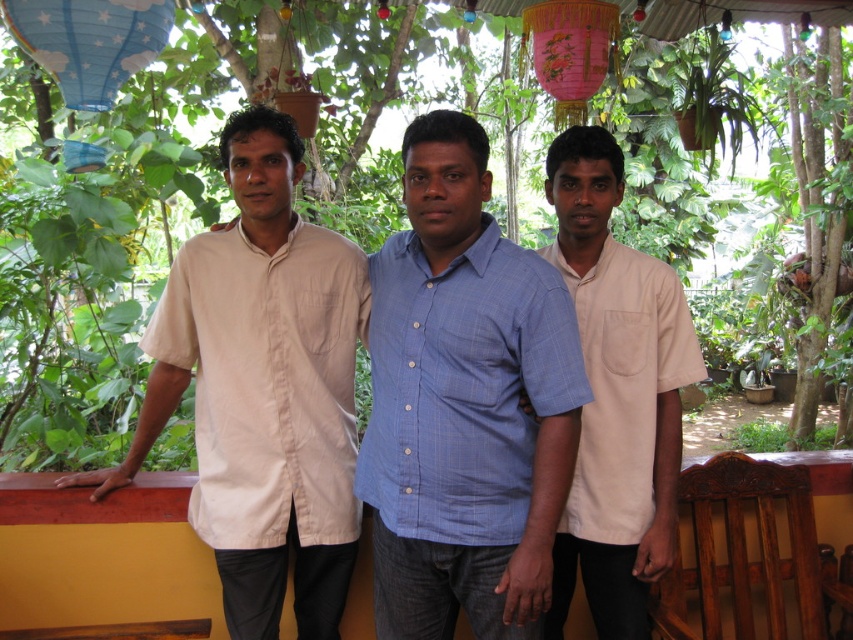
Which is above, matte white shirt at left or white cotton shirt at center?

matte white shirt at left is above.

Which is more to the left, matte white shirt at left or white cotton shirt at center?

matte white shirt at left

Which is in front, point (262, 292) or point (601, 240)?

Point (262, 292) is more forward.

This screenshot has width=853, height=640. Identify the location of matte white shirt at left. (262, 388).

Can you confirm if blue checkered shirt at center is shorter than white cotton shirt at center?

Correct, blue checkered shirt at center is not as tall as white cotton shirt at center.

Can you confirm if blue checkered shirt at center is positioned below white cotton shirt at center?

Incorrect, blue checkered shirt at center is not positioned below white cotton shirt at center.

Who is more forward, (456, 611) or (648, 481)?

Point (648, 481) is more forward.

The image size is (853, 640). I want to click on blue checkered shirt at center, so click(463, 403).

Can you confirm if blue checkered shirt at center is positioned to the left of matte white shirt at left?

No, blue checkered shirt at center is not to the left of matte white shirt at left.

Who is lower down, blue checkered shirt at center or matte white shirt at left?

blue checkered shirt at center is below.

Does point (543, 282) lie behind point (341, 525)?

That is False.

Locate an element on the screen. Image resolution: width=853 pixels, height=640 pixels. blue checkered shirt at center is located at coordinates (463, 403).